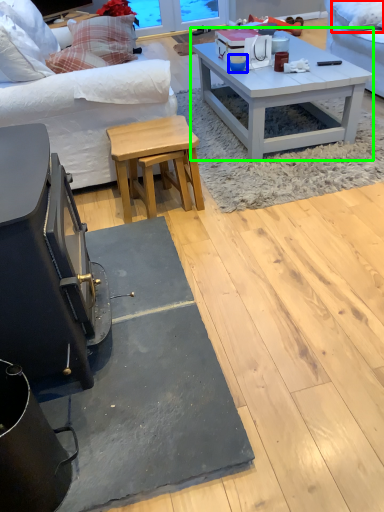
Question: Based on their relative distances, which object is nearer to pillow (highlighted by a red box)? Choose from coffee cup (highlighted by a blue box) and coffee table (highlighted by a green box).

Choices:
 (A) coffee cup
 (B) coffee table

Answer: (B)